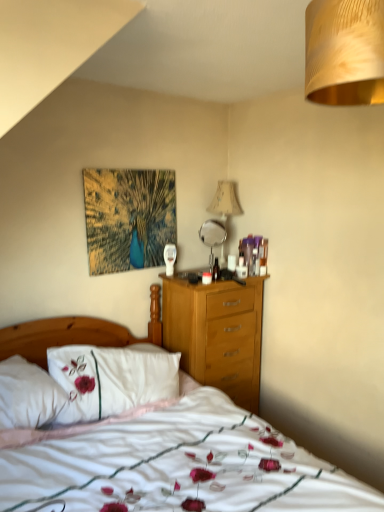
Measure the distance between point [60,396] and camera.

Point [60,396] and camera are 1.98 meters apart.

Find the location of `white embroidered pillow at left`. white embroidered pillow at left is located at coordinates (28, 395).

The height and width of the screenshot is (512, 384). What do you see at coordinates (212, 237) in the screenshot?
I see `metallic silver mirror at center` at bounding box center [212, 237].

At what (x,y) coordinates should I click in order to perform the action: click on white embroidered pillow at left. Please return your answer as a coordinate pair (x, y). Looking at the image, I should click on (28, 395).

Looking at this image, which is in front, beige fabric lampshade at upper center, the first lamp from the back, or gold textured lampshade at upper right, the second lamp when ordered from back to front?

gold textured lampshade at upper right, the second lamp when ordered from back to front, is closer to the camera.

Consider the image. Considering the sizes of objects beige fabric lampshade at upper center, which is the second lamp from front to back, and gold textured lampshade at upper right, marked as the first lamp in a front-to-back arrangement, in the image provided, who is taller, beige fabric lampshade at upper center, which is the second lamp from front to back, or gold textured lampshade at upper right, marked as the first lamp in a front-to-back arrangement,?

With more height is beige fabric lampshade at upper center, which is the second lamp from front to back.

Which of these two, beige fabric lampshade at upper center, which is the second lamp from front to back, or gold textured lampshade at upper right, marked as the first lamp in a front-to-back arrangement, is bigger?

With larger size is beige fabric lampshade at upper center, which is the second lamp from front to back.

Is point (223, 185) positioned in front of point (350, 54)?

That is False.

Is white embroidered pillow at left positioned far away from gold textured lampshade at upper right, the second lamp when ordered from back to front?

Yes, white embroidered pillow at left and gold textured lampshade at upper right, the second lamp when ordered from back to front, are located far from each other.

From a real-world perspective, which object stands above the other?

gold textured lampshade at upper right, marked as the first lamp in a front-to-back arrangement, is physically above.

Which object is positioned more to the left, white embroidered pillow at left or gold textured lampshade at upper right, the second lamp when ordered from back to front?

white embroidered pillow at left is more to the left.

Is white soft bed at center facing towards beige fabric lampshade at upper center, the first lamp from the back?

No.

Is white soft bed at center to the left of beige fabric lampshade at upper center, the first lamp from the back, from the viewer's perspective?

Indeed, white soft bed at center is positioned on the left side of beige fabric lampshade at upper center, the first lamp from the back.

Does point (180, 504) appear closer or farther from the camera than point (236, 193)?

Clearly, point (180, 504) is closer to the camera than point (236, 193).

Which is behind, white soft bed at center or gold textured lampshade at upper right, the second lamp when ordered from back to front?

gold textured lampshade at upper right, the second lamp when ordered from back to front.

Choose the correct answer: Is white soft bed at center inside gold textured lampshade at upper right, marked as the first lamp in a front-to-back arrangement, or outside it?

white soft bed at center is not inside gold textured lampshade at upper right, marked as the first lamp in a front-to-back arrangement, it's outside.

Is white soft bed at center positioned far away from gold textured lampshade at upper right, the second lamp when ordered from back to front?

Yes, white soft bed at center and gold textured lampshade at upper right, the second lamp when ordered from back to front, are quite far apart.

Looking at this image, is beige fabric lampshade at upper center, which is the second lamp from front to back, positioned behind metallic silver mirror at center?

That is True.

Consider the image. Are beige fabric lampshade at upper center, the first lamp from the back, and metallic silver mirror at center making contact?

There is a gap between beige fabric lampshade at upper center, the first lamp from the back, and metallic silver mirror at center.

Visually, is beige fabric lampshade at upper center, the first lamp from the back, positioned to the left or to the right of metallic silver mirror at center?

Based on their positions, beige fabric lampshade at upper center, the first lamp from the back, is located to the right of metallic silver mirror at center.

Between gold textured lampshade at upper right, the second lamp when ordered from back to front, and metallic silver mirror at center, which one has smaller width?

metallic silver mirror at center is thinner.

From the image's perspective, which is below, gold textured lampshade at upper right, marked as the first lamp in a front-to-back arrangement, or metallic silver mirror at center?

metallic silver mirror at center appears lower in the image.

Between gold textured lampshade at upper right, marked as the first lamp in a front-to-back arrangement, and metallic silver mirror at center, which one is positioned behind?

metallic silver mirror at center is further away from the camera.

Does gold textured lampshade at upper right, marked as the first lamp in a front-to-back arrangement, turn towards metallic silver mirror at center?

No, gold textured lampshade at upper right, marked as the first lamp in a front-to-back arrangement, is not turned towards metallic silver mirror at center.

From a real-world perspective, which is physically above, white embroidered pillow at left or beige fabric lampshade at upper center, the first lamp from the back?

beige fabric lampshade at upper center, the first lamp from the back, from a real-world perspective.

Where is `the 1st lamp above the white embroidered pillow at left (from the image's perspective)`? the 1st lamp above the white embroidered pillow at left (from the image's perspective) is located at coordinates (225, 201).

Which is farther, (11, 426) or (218, 192)?

The point (218, 192) is more distant.

Where is `lamp on the left side of gold textured lampshade at upper right, the second lamp when ordered from back to front`? lamp on the left side of gold textured lampshade at upper right, the second lamp when ordered from back to front is located at coordinates (225, 201).

There is a white embroidered pillow at left. Where is `the 2nd lamp above it (from a real-world perspective)`? the 2nd lamp above it (from a real-world perspective) is located at coordinates (344, 52).

Based on the photo, when comparing their distances from white soft bed at center, does metallic silver mirror at center or beige fabric lampshade at upper center, the first lamp from the back, seem further?

Based on the image, beige fabric lampshade at upper center, the first lamp from the back, appears to be further to white soft bed at center.

Which object lies nearer to the anchor point metallic silver mirror at center, gold textured lampshade at upper right, the second lamp when ordered from back to front, or beige fabric lampshade at upper center, which is the second lamp from front to back?

Among the two, beige fabric lampshade at upper center, which is the second lamp from front to back, is located nearer to metallic silver mirror at center.

From the image, which object appears to be nearer to gold textured lampshade at upper right, marked as the first lamp in a front-to-back arrangement, white embroidered pillow at left or white soft bed at center?

The object closer to gold textured lampshade at upper right, marked as the first lamp in a front-to-back arrangement, is white soft bed at center.

Estimate the real-world distances between objects in this image. Which object is further from beige fabric lampshade at upper center, the first lamp from the back, metallic silver mirror at center or white embroidered pillow at left?

Based on the image, white embroidered pillow at left appears to be further to beige fabric lampshade at upper center, the first lamp from the back.

Based on their spatial positions, is metallic silver mirror at center or white soft bed at center closer to white embroidered pillow at left?

Among the two, white soft bed at center is located nearer to white embroidered pillow at left.

Estimate the real-world distances between objects in this image. Which object is further from gold textured lampshade at upper right, marked as the first lamp in a front-to-back arrangement, metallic silver mirror at center or white embroidered pillow at left?

Among the two, metallic silver mirror at center is located further to gold textured lampshade at upper right, marked as the first lamp in a front-to-back arrangement.

Looking at the image, which one is located further to beige fabric lampshade at upper center, which is the second lamp from front to back, white soft bed at center or metallic silver mirror at center?

Among the two, white soft bed at center is located further to beige fabric lampshade at upper center, which is the second lamp from front to back.

Based on their spatial positions, is gold textured lampshade at upper right, marked as the first lamp in a front-to-back arrangement, or beige fabric lampshade at upper center, the first lamp from the back, further from white soft bed at center?

gold textured lampshade at upper right, marked as the first lamp in a front-to-back arrangement, is further to white soft bed at center.

I want to click on lamp located between white soft bed at center and metallic silver mirror at center in the depth direction, so click(344, 52).

Locate an element on the screen. This screenshot has width=384, height=512. mirror positioned between white soft bed at center and beige fabric lampshade at upper center, which is the second lamp from front to back, from near to far is located at coordinates (212, 237).

Image resolution: width=384 pixels, height=512 pixels. What are the coordinates of `pillow between white soft bed at center and beige fabric lampshade at upper center, the first lamp from the back, from front to back` in the screenshot? It's located at (28, 395).

Where is `pillow between gold textured lampshade at upper right, the second lamp when ordered from back to front, and beige fabric lampshade at upper center, which is the second lamp from front to back, along the z-axis`? pillow between gold textured lampshade at upper right, the second lamp when ordered from back to front, and beige fabric lampshade at upper center, which is the second lamp from front to back, along the z-axis is located at coordinates (28, 395).